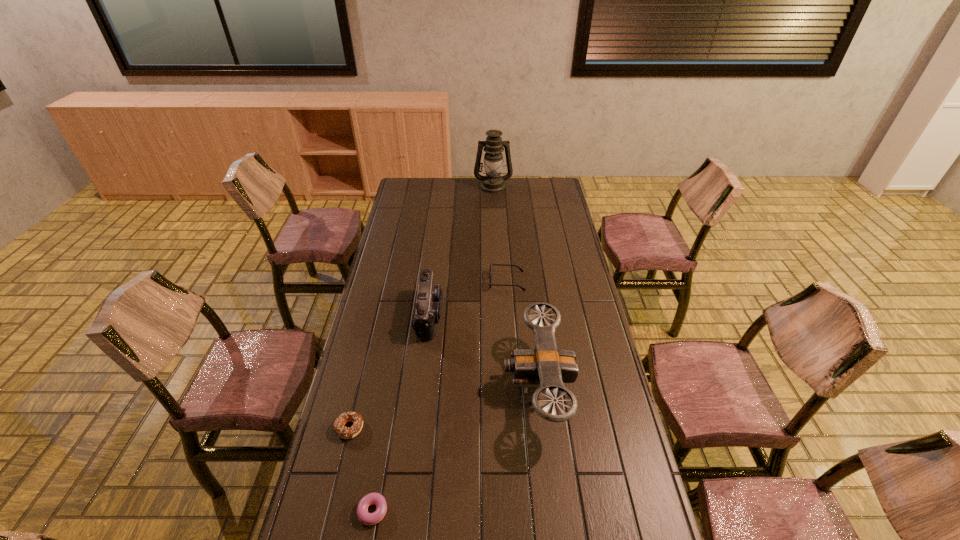
What are the coordinates of `free region located on the front-facing side of the drone` in the screenshot? It's located at (453, 386).

At what (x,y) coordinates should I click in order to perform the action: click on free space located on the front-facing side of the drone. Please return your answer as a coordinate pair (x, y). The height and width of the screenshot is (540, 960). Looking at the image, I should click on (470, 386).

What are the coordinates of `vacant space located 0.060m on the front-facing side of the drone` in the screenshot? It's located at (486, 386).

Identify the location of blank space located 0.400m on the front-facing side of the fourth shortest object. This screenshot has height=540, width=960. 544,315.

The height and width of the screenshot is (540, 960). Identify the location of free space located 0.150m on the front-facing side of the spectacles. (454, 281).

The image size is (960, 540). In order to click on free space located 0.180m on the front-facing side of the spectacles in this screenshot , I will do [x=447, y=281].

Locate an element on the screen. The image size is (960, 540). free space located 0.090m on the front-facing side of the spectacles is located at coordinates (468, 281).

Identify the location of vacant space located on the right of the fifth tallest object. (428, 428).

Locate an element on the screen. This screenshot has width=960, height=540. free space located 0.350m on the back of the shortest object is located at coordinates (393, 389).

You are a GUI agent. You are given a task and a screenshot of the screen. Output one action in this format:
    pyautogui.click(x=<x>, y=<y>)
    Task: Click on the object positioned at the far edge
    
    Given the screenshot: What is the action you would take?
    pyautogui.click(x=493, y=146)